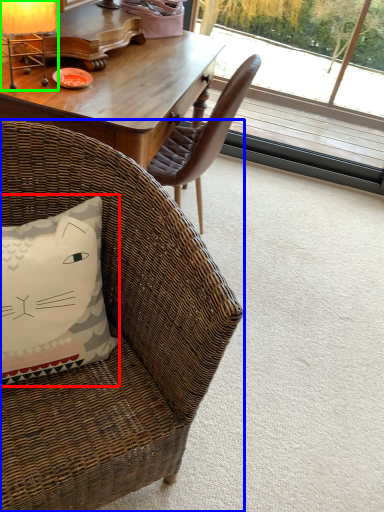
Question: Based on their relative distances, which object is farther from pillow (highlighted by a red box)? Choose from chair (highlighted by a blue box) and table lamp (highlighted by a green box).

Choices:
 (A) chair
 (B) table lamp

Answer: (B)